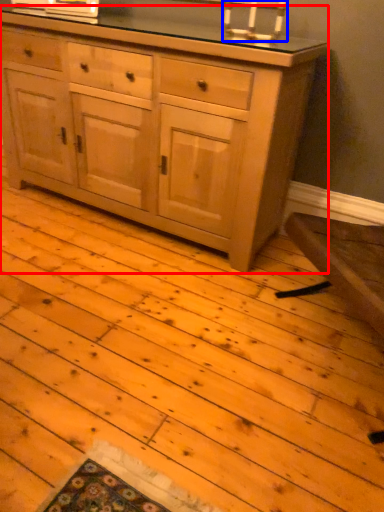
Question: Which point is further to the camera, chest of drawers (highlighted by a red box) or candle holder (highlighted by a blue box)?

Choices:
 (A) chest of drawers
 (B) candle holder

Answer: (B)